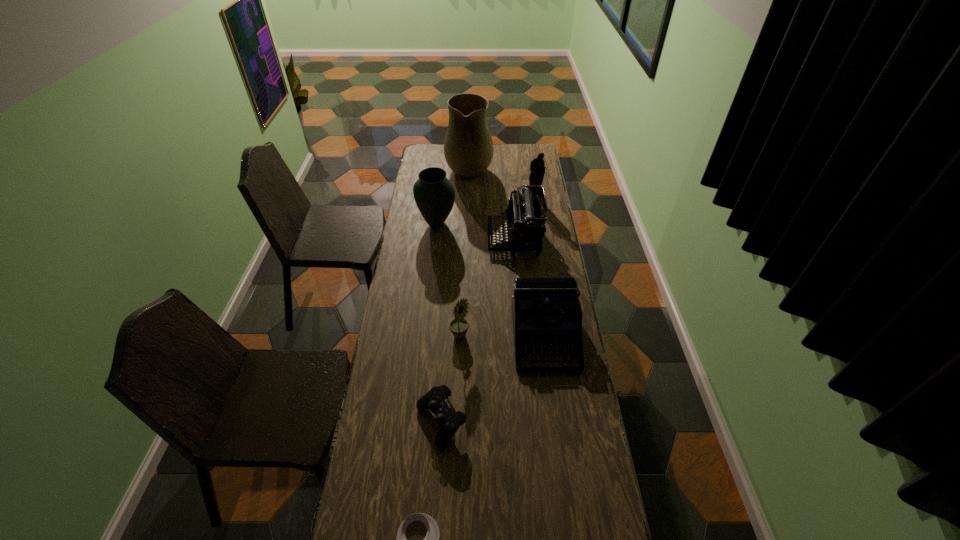
Image resolution: width=960 pixels, height=540 pixels. I want to click on free spot between the vase and the sunflower, so click(x=448, y=280).

Locate an element on the screen. The height and width of the screenshot is (540, 960). unoccupied position between the control and the shorter typewriter is located at coordinates (492, 380).

Where is `free space between the shorter typewriter and the control`? free space between the shorter typewriter and the control is located at coordinates (492, 380).

Where is `the fourth closest object to the vase`? This screenshot has width=960, height=540. the fourth closest object to the vase is located at coordinates (546, 311).

Where is `the fourth closest object to the seventh farthest object`? The width and height of the screenshot is (960, 540). the fourth closest object to the seventh farthest object is located at coordinates (526, 215).

Identify the location of free spot that satisfies the following two spatial constraints: 1. on the front-facing side of the figurine; 2. on the face of the sunflower. (555, 336).